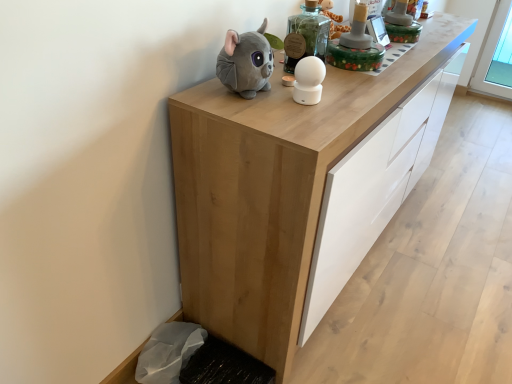
Where is `free point in front of white matte ball at center, which is counted as the 1th toy, starting from the right`? free point in front of white matte ball at center, which is counted as the 1th toy, starting from the right is located at coordinates (309, 122).